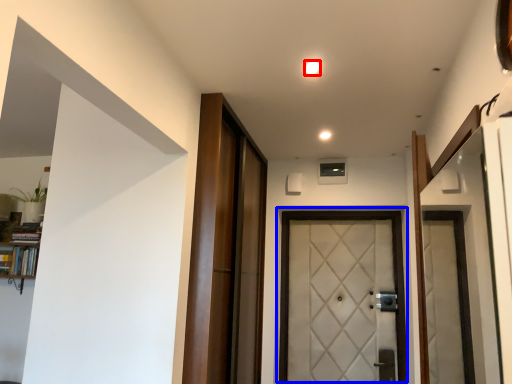
Question: Which of the following is the farthest to the observer, light (highlighted by a red box) or door (highlighted by a blue box)?

Choices:
 (A) light
 (B) door

Answer: (B)